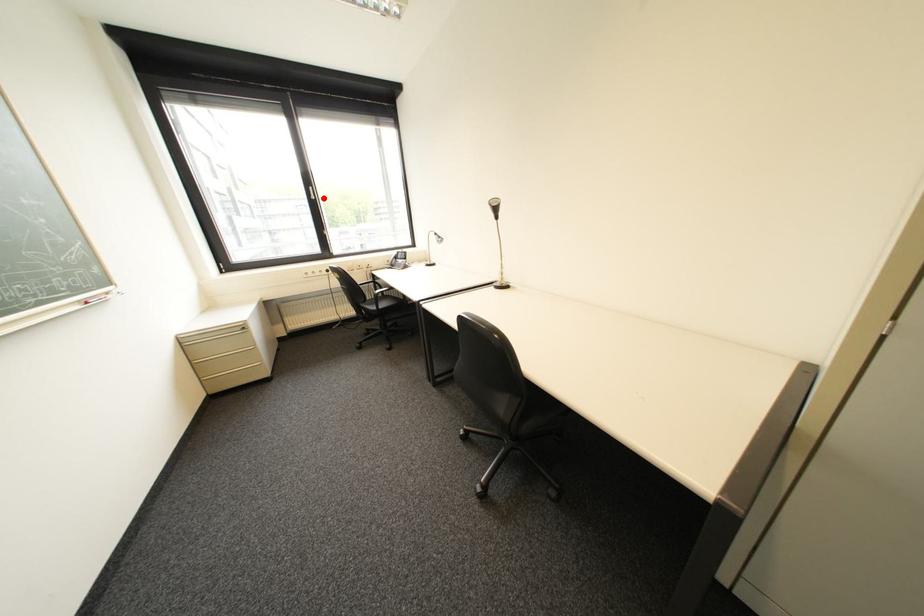
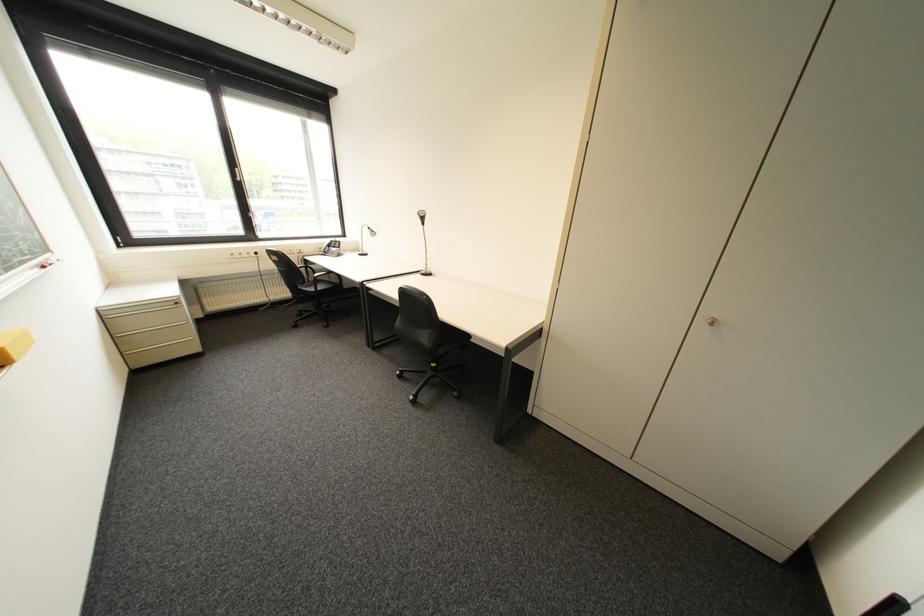
Question: I am providing you with two images of the same scene from different viewpoints. A red point is shown in image1. For the corresponding object point in image2, is it positioned nearer or farther from the camera?

Choices:
 (A) Nearer
 (B) Farther

Answer: (B)